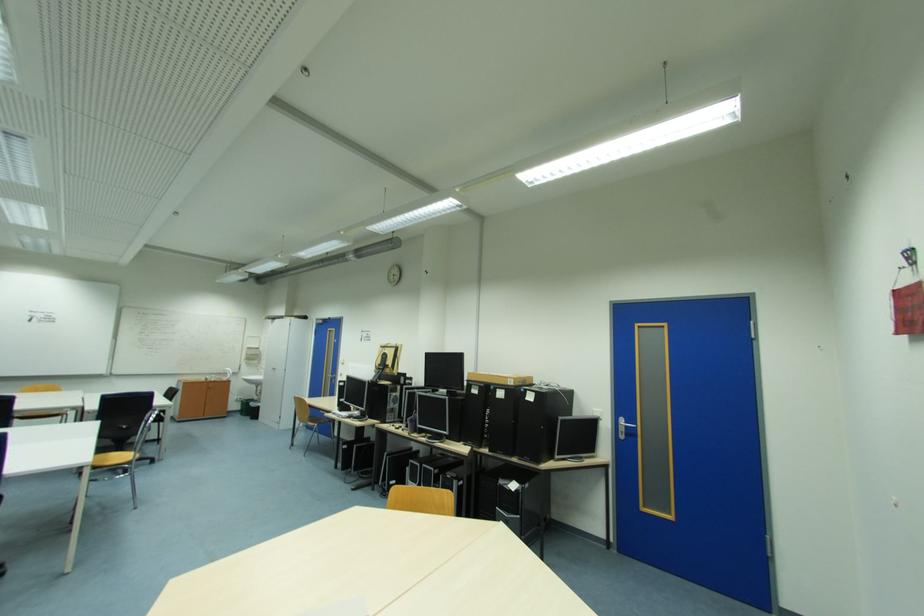
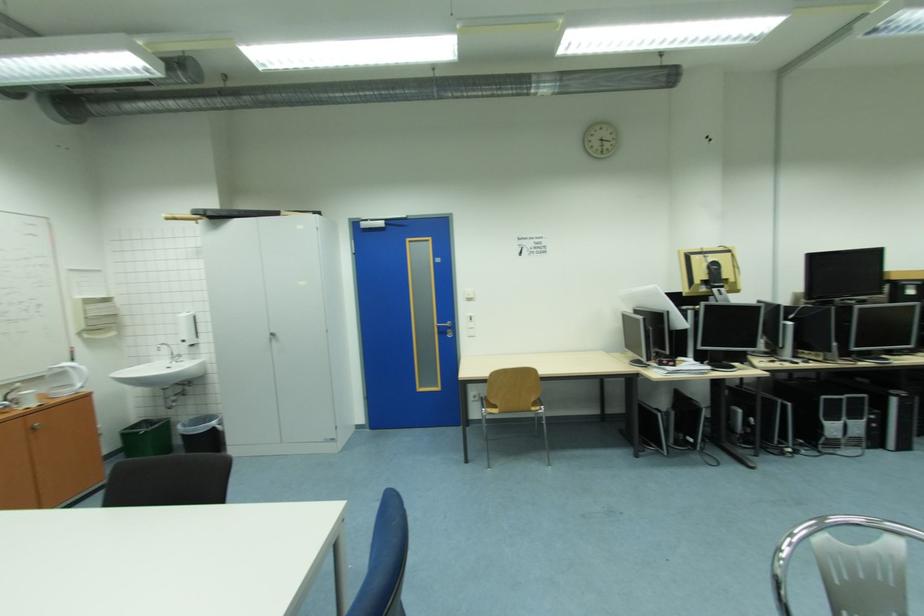
In the second image, find the point that corresponds to [349,365] in the first image.

(477, 301)